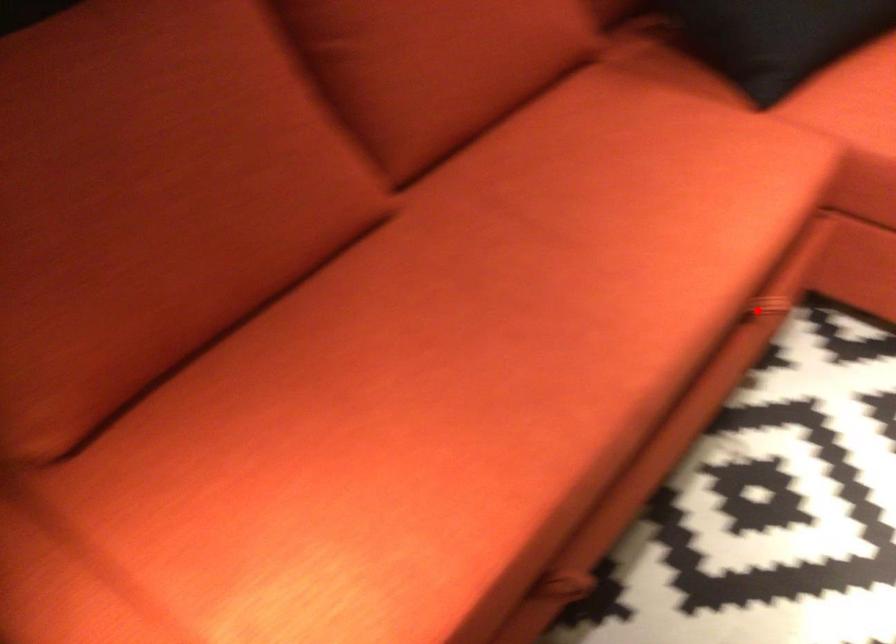
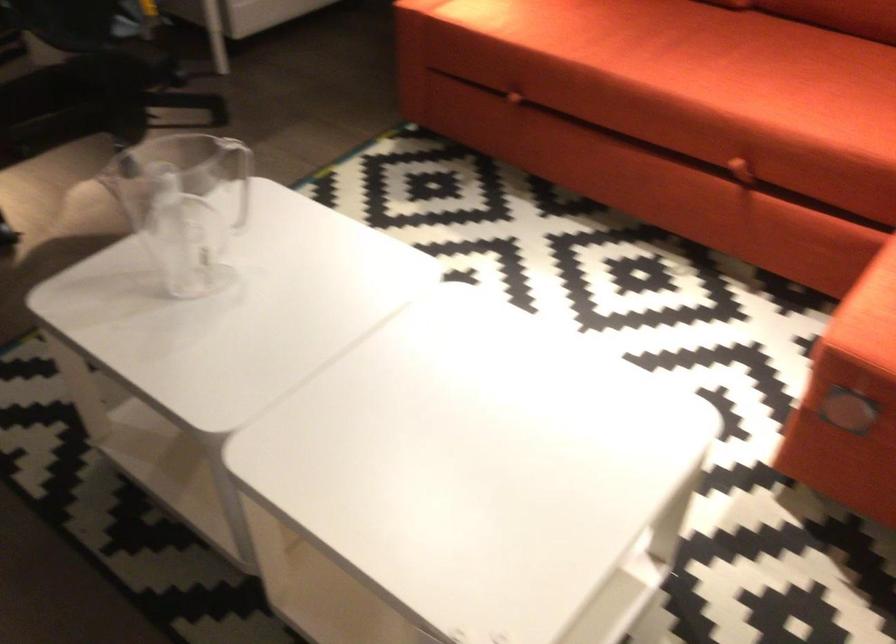
Question: I am providing you with two images of the same scene from different viewpoints. A red point is shown in image1. For the corresponding object point in image2, is it positioned nearer or farther from the camera?

Choices:
 (A) Nearer
 (B) Farther

Answer: (B)